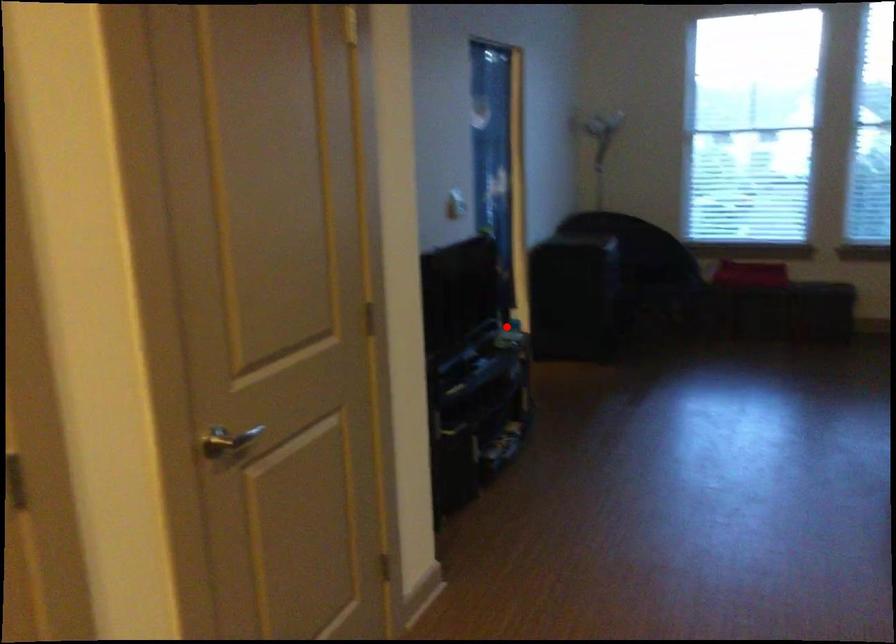
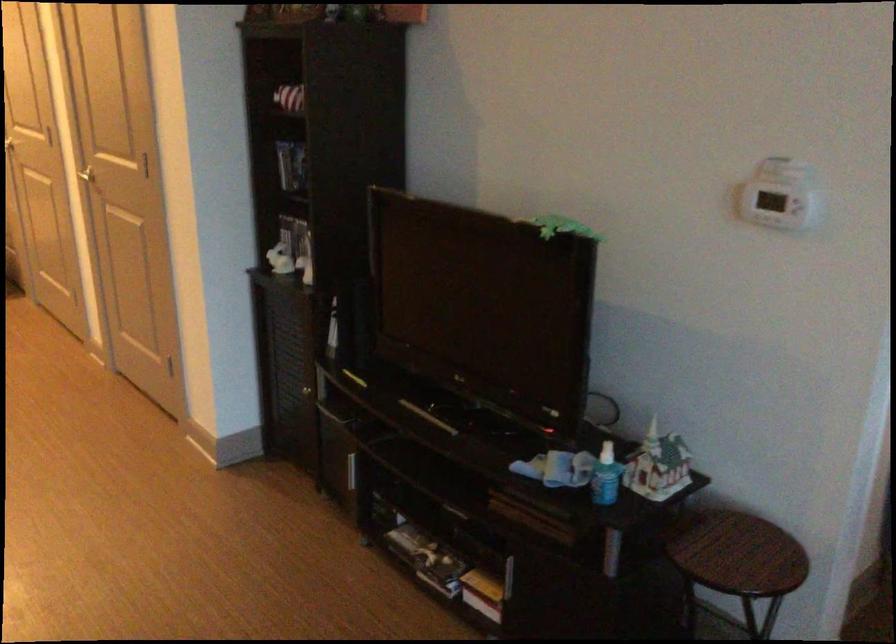
Question: A red point is marked in image1. In image2, is the corresponding 3D point closer to the camera or farther? Reply with the corresponding letter.

Choices:
 (A) The corresponding 3D point is closer.
 (B) The corresponding 3D point is farther.

Answer: (A)